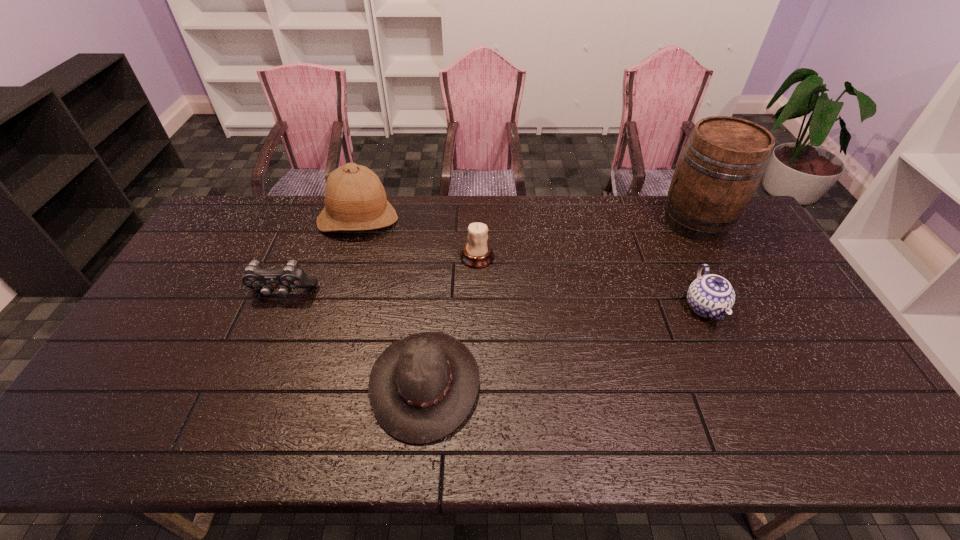
Where is `free region located 0.210m on the side of the cider near the bung hole`? This screenshot has height=540, width=960. free region located 0.210m on the side of the cider near the bung hole is located at coordinates pyautogui.click(x=600, y=222).

This screenshot has width=960, height=540. Find the location of `blank space located on the front-facing side of the left hat`. blank space located on the front-facing side of the left hat is located at coordinates (340, 279).

Identify the location of vacant space located on the right of the candle holder. (546, 257).

Find the location of a particular element. This screenshot has height=540, width=960. free region located 0.250m on the surface of the control with buttons is located at coordinates (248, 379).

Locate an element on the screen. This screenshot has height=540, width=960. free region located 0.070m at the spout of the chinaware is located at coordinates (728, 357).

In order to click on vacant space located 0.210m on the front-facing side of the shorter hat in this screenshot , I will do `click(563, 383)`.

Image resolution: width=960 pixels, height=540 pixels. Identify the location of cider situated at the far edge. click(722, 163).

Locate an element on the screen. This screenshot has height=540, width=960. hat located in the far edge section of the desktop is located at coordinates (355, 199).

Find the location of a particular element. object situated at the near edge is located at coordinates (421, 388).

Locate an element on the screen. object that is positioned at the right edge is located at coordinates (722, 163).